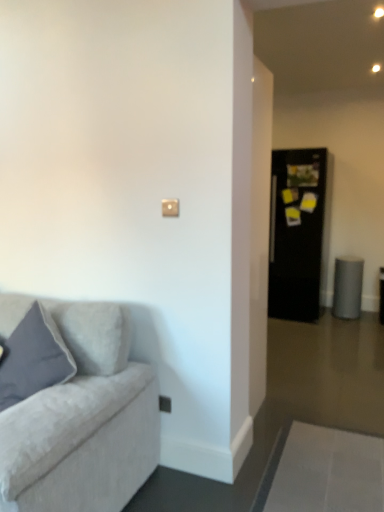
Question: In terms of size, does satin silver outlet at lower center appear bigger or smaller than matte beige switch at upper center?

Choices:
 (A) big
 (B) small

Answer: (A)

Question: Visually, is satin silver outlet at lower center positioned to the left or to the right of matte beige switch at upper center?

Choices:
 (A) left
 (B) right

Answer: (A)

Question: Estimate the real-world distances between objects in this image. Which object is farther from the matte gray pillow at left?

Choices:
 (A) matte beige switch at upper center
 (B) satin silver outlet at lower center
 (C) black glossy refrigerator at right

Answer: (C)

Question: Estimate the real-world distances between objects in this image. Which object is farther from the satin silver outlet at lower center?

Choices:
 (A) black glossy refrigerator at right
 (B) matte beige switch at upper center
 (C) matte gray pillow at left

Answer: (A)